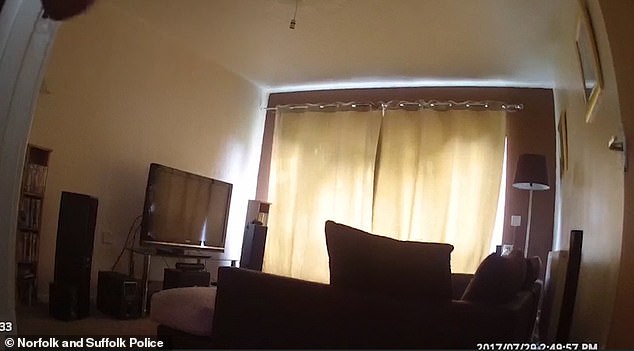
Where is `windows on door`? windows on door is located at coordinates (586, 67), (562, 141).